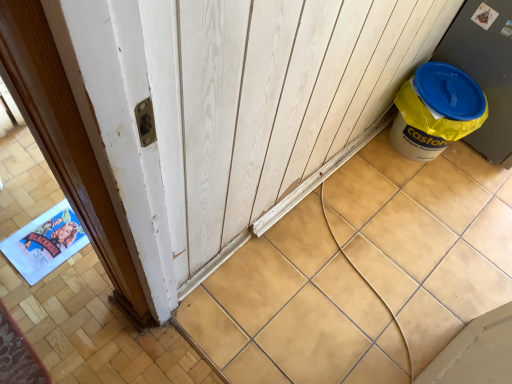
The height and width of the screenshot is (384, 512). What do you see at coordinates (436, 111) in the screenshot?
I see `yellow plastic canister at right` at bounding box center [436, 111].

Find the location of `yellow plastic canister at right`. yellow plastic canister at right is located at coordinates (436, 111).

What do you see at coordinates (269, 104) in the screenshot? This screenshot has height=384, width=512. I see `wooden at lower right` at bounding box center [269, 104].

At what (x,y) coordinates should I click in order to perform the action: click on wooden at lower right. Please return your answer as a coordinate pair (x, y). Looking at the image, I should click on (269, 104).

This screenshot has width=512, height=384. In order to click on yellow plastic canister at right in this screenshot , I will do `click(436, 111)`.

Which object is positioned more to the right, yellow plastic canister at right or wooden at lower right?

yellow plastic canister at right.

Considering the positions of objects yellow plastic canister at right and wooden at lower right in the image provided, who is in front, yellow plastic canister at right or wooden at lower right?

wooden at lower right is in front.

Which is behind, point (400, 118) or point (388, 92)?

Positioned behind is point (400, 118).

From the image's perspective, is yellow plastic canister at right beneath wooden at lower right?

Incorrect, from the image's perspective, yellow plastic canister at right is higher than wooden at lower right.

From a real-world perspective, is yellow plastic canister at right under wooden at lower right?

Actually, yellow plastic canister at right is physically above wooden at lower right in the real world.

Is yellow plastic canister at right wider than wooden at lower right?

Incorrect, the width of yellow plastic canister at right does not surpass that of wooden at lower right.

Between yellow plastic canister at right and wooden at lower right, which one has less height?

With less height is wooden at lower right.

In the scene shown: Which of these two, yellow plastic canister at right or wooden at lower right, is bigger?

wooden at lower right is bigger.

Is yellow plastic canister at right outside of wooden at lower right?

That's correct, yellow plastic canister at right is outside of wooden at lower right.

Is yellow plastic canister at right next to wooden at lower right?

There is a gap between yellow plastic canister at right and wooden at lower right.

Could you tell me if yellow plastic canister at right is turned towards wooden at lower right?

No, yellow plastic canister at right does not turn towards wooden at lower right.

How different are the orientations of yellow plastic canister at right and wooden at lower right in degrees?

There is a 88.7-degree angle between the facing directions of yellow plastic canister at right and wooden at lower right.

Image resolution: width=512 pixels, height=384 pixels. Identify the location of waste container above the wooden at lower right (from the image's perspective). (436, 111).

Between wooden at lower right and yellow plastic canister at right, which one appears on the left side from the viewer's perspective?

wooden at lower right.

In the image, is wooden at lower right positioned in front of or behind yellow plastic canister at right?

wooden at lower right is in front of yellow plastic canister at right.

Is point (265, 104) in front of point (429, 148)?

Yes, point (265, 104) is closer to viewer.

From the image's perspective, between wooden at lower right and yellow plastic canister at right, who is located below?

From the image's view, wooden at lower right is below.

From a real-world perspective, who is located higher, wooden at lower right or yellow plastic canister at right?

In real-world perspective, yellow plastic canister at right is above.

Can you confirm if wooden at lower right is thinner than yellow plastic canister at right?

No, wooden at lower right is not thinner than yellow plastic canister at right.

Looking at this image, considering the sizes of objects wooden at lower right and yellow plastic canister at right in the image provided, who is shorter, wooden at lower right or yellow plastic canister at right?

wooden at lower right.

Can you confirm if wooden at lower right is bigger than yellow plastic canister at right?

Indeed, wooden at lower right has a larger size compared to yellow plastic canister at right.

Could yellow plastic canister at right be considered to be inside wooden at lower right?

No.

Is wooden at lower right in contact with yellow plastic canister at right?

No, wooden at lower right is not in contact with yellow plastic canister at right.

Could you tell me if wooden at lower right is facing yellow plastic canister at right?

No.

How many degrees apart are the facing directions of wooden at lower right and yellow plastic canister at right?

The angular difference between wooden at lower right and yellow plastic canister at right is 88.7 degrees.

How distant is wooden at lower right from yellow plastic canister at right?

wooden at lower right and yellow plastic canister at right are 21.53 inches apart.

Identify the location of barn door below the yellow plastic canister at right (from a real-world perspective). (269, 104).

Locate an element on the screen. The width and height of the screenshot is (512, 384). waste container above the wooden at lower right (from a real-world perspective) is located at coordinates (436, 111).

Where is `waste container above the wooden at lower right (from the image's perspective)`? The width and height of the screenshot is (512, 384). waste container above the wooden at lower right (from the image's perspective) is located at coordinates (436, 111).